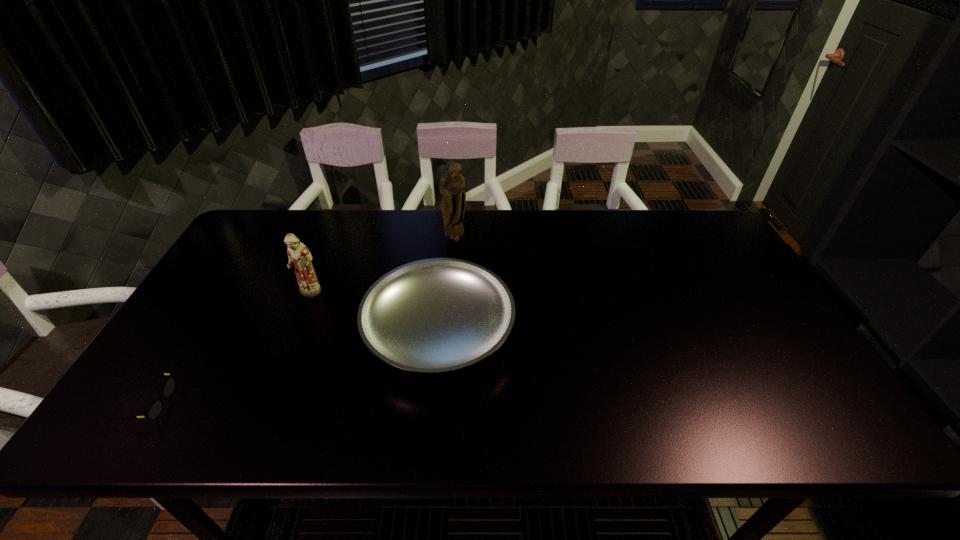
Where is `free spot between the spectacles and the nearer figurine`? The image size is (960, 540). free spot between the spectacles and the nearer figurine is located at coordinates (228, 349).

Identify the location of free space between the spectacles and the tallest object. (300, 321).

This screenshot has width=960, height=540. I want to click on empty location between the farthest object and the spectacles, so click(300, 321).

Locate an element on the screen. The width and height of the screenshot is (960, 540). blank region between the bedpan and the spectacles is located at coordinates (293, 366).

This screenshot has width=960, height=540. Find the location of `blank region between the right figurine and the second object from left to right`. blank region between the right figurine and the second object from left to right is located at coordinates (382, 267).

Where is `free space between the third object from right to left and the spectacles`? The image size is (960, 540). free space between the third object from right to left and the spectacles is located at coordinates (228, 349).

The image size is (960, 540). I want to click on the second closest object to the taller figurine, so click(x=299, y=256).

Identify which object is the second closest to the farthest object. Please provide its 2D coordinates. Your answer should be formatted as a tuple, i.e. [(x, y)], where the tuple contains the x and y coordinates of a point satisfying the conditions above.

[(299, 256)]

I want to click on free space in the image that satisfies the following two spatial constraints: 1. on the front-facing side of the second shortest object; 2. on the left side of the second tallest object, so click(295, 328).

The width and height of the screenshot is (960, 540). In order to click on free space that satisfies the following two spatial constraints: 1. on the front-facing side of the second shortest object; 2. on the right side of the second tallest object in this screenshot , I will do `click(295, 328)`.